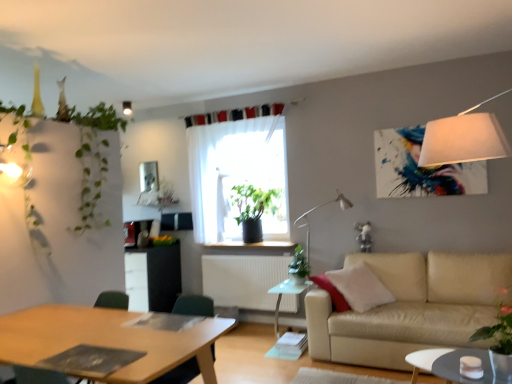
Question: From a real-world perspective, is sheer white curtain at center positioned above or below green leafy plant at upper left, which is the first plant from left to right?

Choices:
 (A) below
 (B) above

Answer: (B)

Question: Considering the positions of sheer white curtain at center and green leafy plant at upper left, which is the first plant from left to right, in the image, is sheer white curtain at center wider or thinner than green leafy plant at upper left, which is the first plant from left to right,?

Choices:
 (A) thin
 (B) wide

Answer: (A)

Question: Estimate the real-world distances between objects in this image. Which object is closer to the wooden desk at lower left?

Choices:
 (A) white glossy coffee table at lower right
 (B) white matte light fixture at upper center
 (C) green matte plant at center, which appears as the 2th plant when viewed from the back
 (D) green leafy plant at center, marked as the 2th plant in a left-to-right arrangement
 (E) beige leather couch at lower right

Answer: (A)

Question: Which is nearer to the green leafy plant at center, the 5th plant viewed from the front?

Choices:
 (A) wooden desk at lower left
 (B) green plastic swivel chair at lower left
 (C) green matte plant at center, which appears as the third plant when viewed from the left
 (D) sheer white curtain at center
 (E) translucent plastic table at center

Answer: (D)